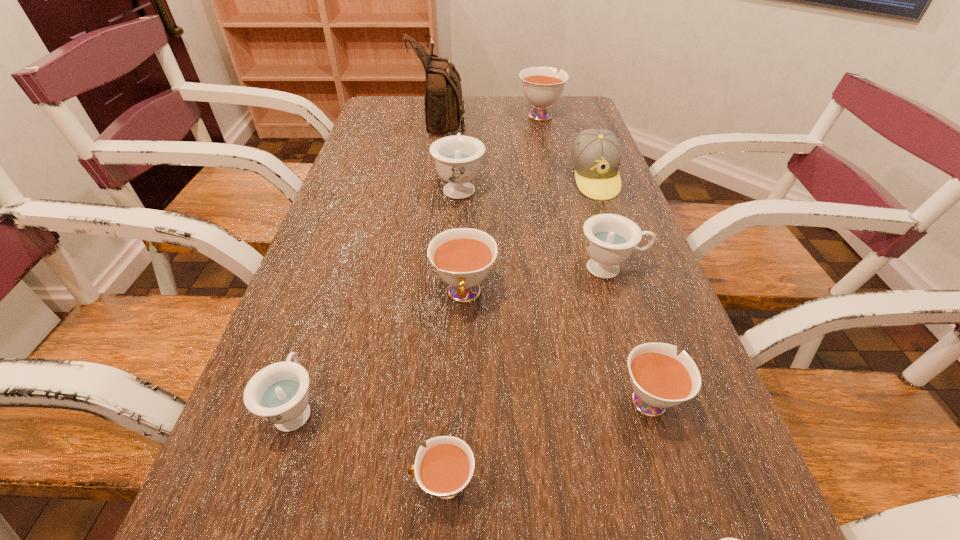
Point out which blue teacup is positioned as the second nearest to the second biggest white teacup. Please provide its 2D coordinates. Your answer should be formatted as a tuple, i.e. [(x, y)], where the tuple contains the x and y coordinates of a point satisfying the conditions above.

[(279, 394)]

This screenshot has height=540, width=960. What are the coordinates of `blue teacup that stands as the second closest to the farthest blue teacup` in the screenshot? It's located at (279, 394).

Where is `vacant space that satisfies the following two spatial constraints: 1. on the side of the second biggest white teacup with the handle; 2. on the side of the seventh farthest teacup with the handle`? The width and height of the screenshot is (960, 540). vacant space that satisfies the following two spatial constraints: 1. on the side of the second biggest white teacup with the handle; 2. on the side of the seventh farthest teacup with the handle is located at coordinates (457, 485).

This screenshot has width=960, height=540. Identify the location of vacant space that satisfies the following two spatial constraints: 1. on the front-facing side of the baseball cap; 2. on the side of the ninth farthest object with the handle. (701, 485).

Locate an element on the screen. The height and width of the screenshot is (540, 960). vacant region that satisfies the following two spatial constraints: 1. on the front-facing side of the tallest object; 2. on the side of the seventh nearest teacup with the handle is located at coordinates (432, 186).